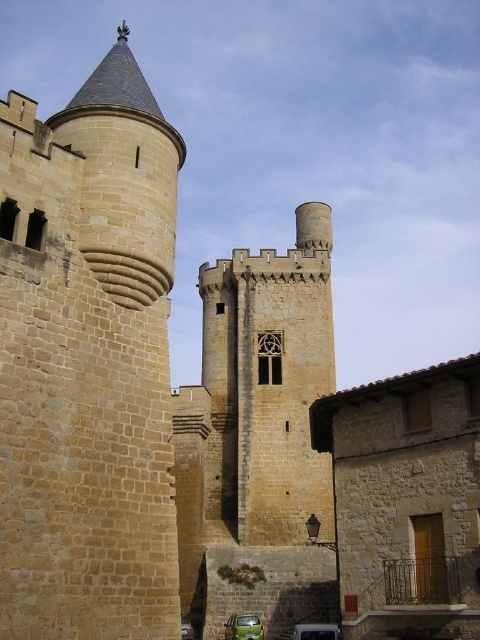
You are standing in front of the medieval stone building and want to determine the relative positions of two points marked on the structure. Which of the two points, point (146, 147) or point (285, 346), is closer to you?

Point (146, 147) is closer to the viewer than point (285, 346).

You are an architect studying the layout of this medieval stone building. You need to locate the brown stone tower at left in the image. Can you determine its coordinates?

The brown stone tower at left is located at coordinates point (87, 362).